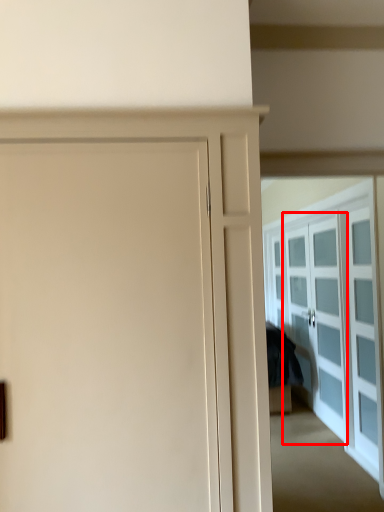
Question: Observing the image, what is the correct spatial positioning of screen door (annotated by the red box) in reference to door?

Choices:
 (A) left
 (B) right

Answer: (B)